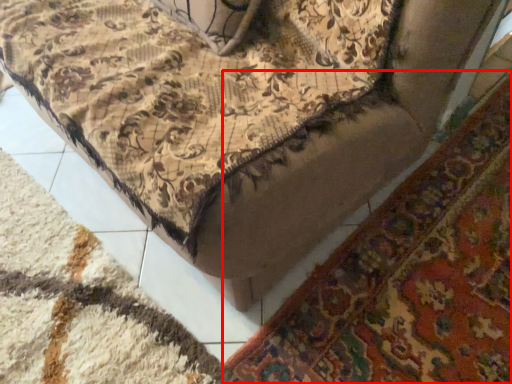
Question: From the image's perspective, what is the correct spatial positioning of mat (annotated by the red box) in reference to mat?

Choices:
 (A) below
 (B) above

Answer: (B)